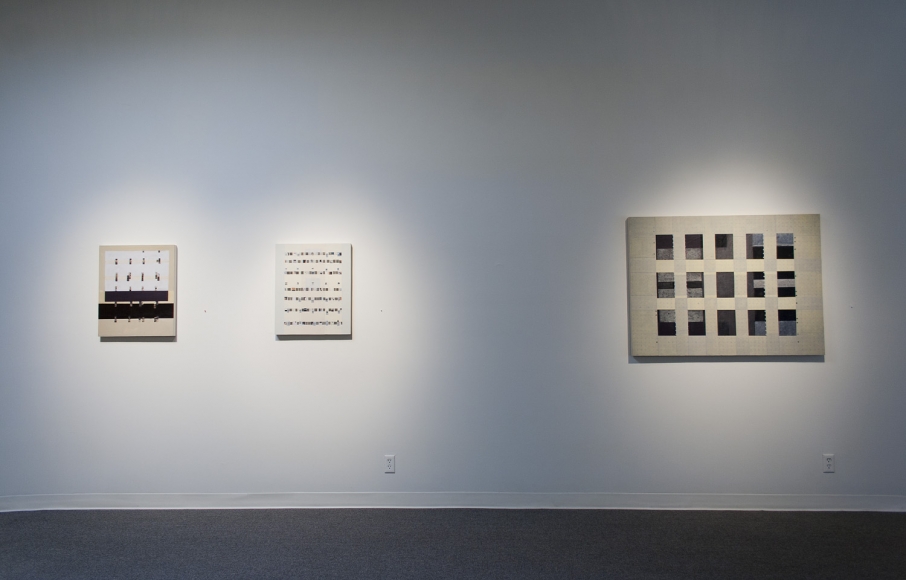
You are a GUI agent. You are given a task and a screenshot of the screen. Output one action in this format:
    pyautogui.click(x=<x>, y=<y>)
    Task: Click on the floor
    This screenshot has height=580, width=906.
    Given the screenshot: What is the action you would take?
    pyautogui.click(x=422, y=541)